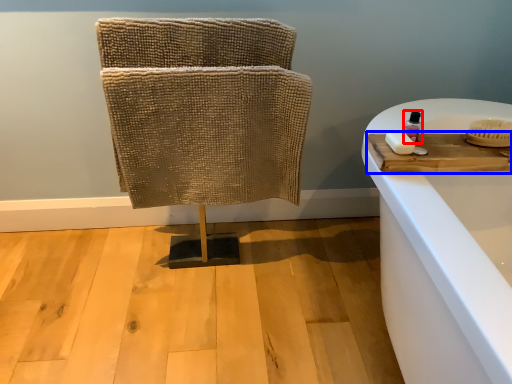
Question: Among these objects, which one is farthest to the camera, toiletry (highlighted by a red box) or wood (highlighted by a blue box)?

Choices:
 (A) toiletry
 (B) wood

Answer: (A)